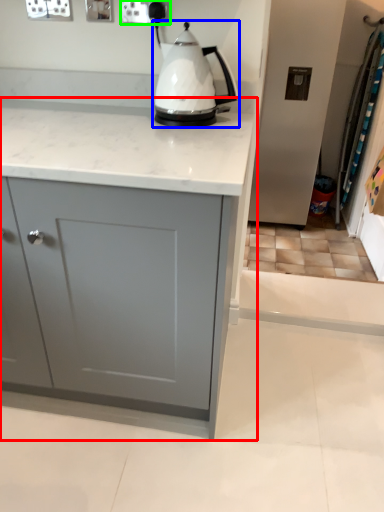
Question: Considering the real-world distances, which object is closest to cabinetry (highlighted by a red box)? kettle (highlighted by a blue box) or electric outlet (highlighted by a green box).

Choices:
 (A) kettle
 (B) electric outlet

Answer: (A)